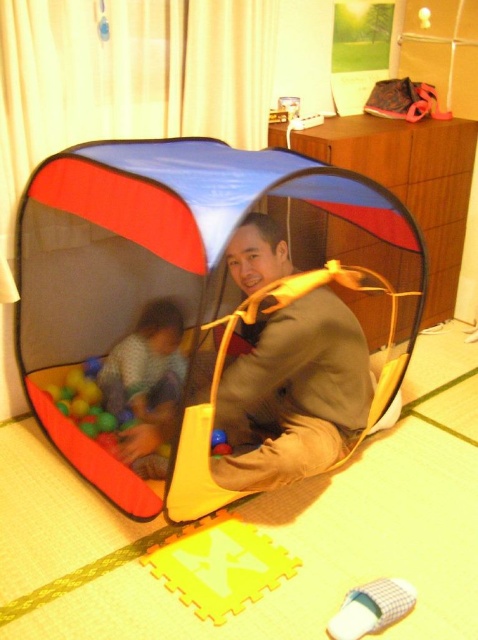
Who is higher up, brown suede jacket at center or patterned fabric child at center?

Positioned higher is brown suede jacket at center.

What do you see at coordinates (293, 394) in the screenshot? I see `brown suede jacket at center` at bounding box center [293, 394].

Which is in front, point (228, 378) or point (144, 413)?

Point (228, 378) is more forward.

Where is `brown suede jacket at center`? brown suede jacket at center is located at coordinates (293, 394).